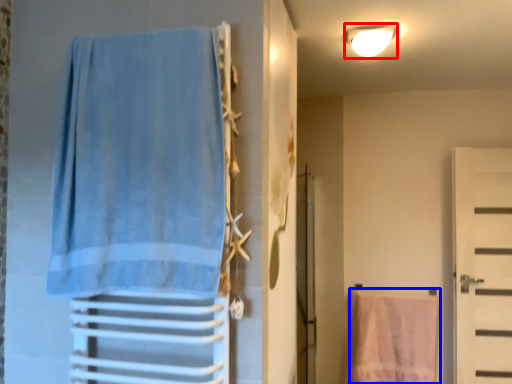
Question: Which of the following is the closest to the observer, light fixture (highlighted by a red box) or beach towel (highlighted by a blue box)?

Choices:
 (A) light fixture
 (B) beach towel

Answer: (A)